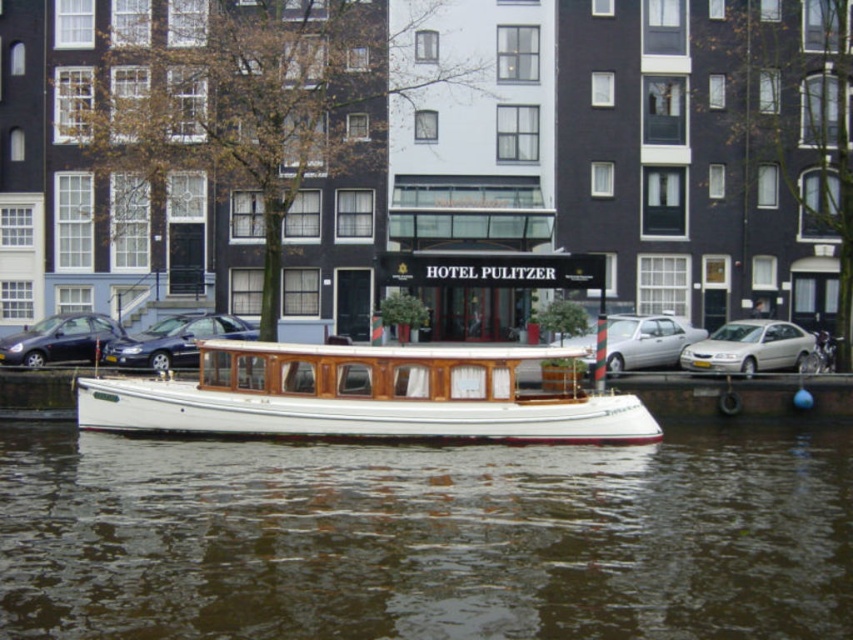
Question: Is transparent water at center to the left of matte black car at left from the viewer's perspective?

Choices:
 (A) yes
 (B) no

Answer: (B)

Question: Is white wood boat at center positioned behind shiny black car at center?

Choices:
 (A) no
 (B) yes

Answer: (A)

Question: Which point is closer to the camera?

Choices:
 (A) silver metallic sedan at center
 (B) shiny black car at center

Answer: (A)

Question: Based on their relative distances, which object is nearer to the white wood boat at center?

Choices:
 (A) silver metallic sedan at center
 (B) silver metallic sedan at right
 (C) shiny black car at center

Answer: (A)

Question: Which point appears farthest from the camera in this image?

Choices:
 (A) (590, 336)
 (B) (720, 330)
 (C) (83, 336)

Answer: (C)

Question: Is the position of transparent water at center less distant than that of shiny black car at center?

Choices:
 (A) no
 (B) yes

Answer: (B)